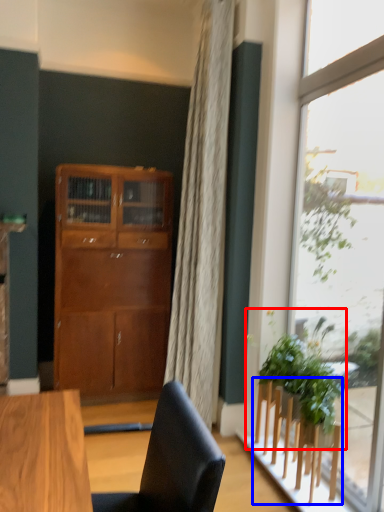
Question: Which object appears closest to the camera in this image, houseplant (highlighted by a red box) or furniture (highlighted by a blue box)?

Choices:
 (A) houseplant
 (B) furniture

Answer: (B)